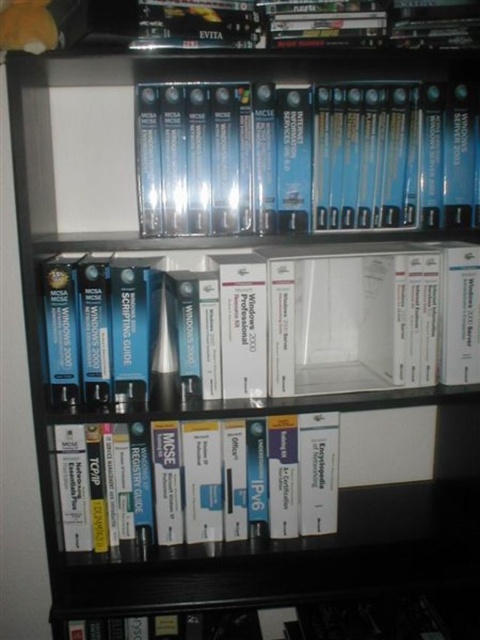
Which is more to the right, blue matte book at center or orange plush toy at upper left?

From the viewer's perspective, blue matte book at center appears more on the right side.

Can you confirm if blue matte book at center is taller than orange plush toy at upper left?

Indeed, blue matte book at center has a greater height compared to orange plush toy at upper left.

Image resolution: width=480 pixels, height=640 pixels. I want to click on blue matte book at center, so click(x=347, y=317).

Describe the element at coordinates (305, 157) in the screenshot. The width and height of the screenshot is (480, 640). I see `blue matte book at upper center` at that location.

This screenshot has height=640, width=480. Describe the element at coordinates (305, 157) in the screenshot. I see `blue matte book at upper center` at that location.

Identify the location of blue matte book at upper center. The image size is (480, 640). (305, 157).

Does hardcover book at upper center have a greater width compared to orange plush toy at upper left?

Yes.

Is hardcover book at upper center smaller than orange plush toy at upper left?

→ No, hardcover book at upper center is not smaller than orange plush toy at upper left.

Image resolution: width=480 pixels, height=640 pixels. Describe the element at coordinates (240, 22) in the screenshot. I see `hardcover book at upper center` at that location.

Locate an element on the screen. The width and height of the screenshot is (480, 640). hardcover book at upper center is located at coordinates (240, 22).